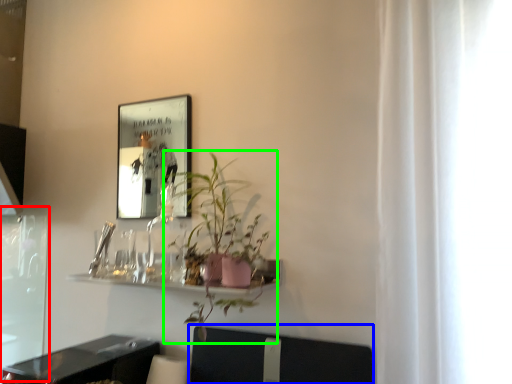
Question: Considering the real-world distances, which object is closest to screen door (highlighted by a red box)? swivel chair (highlighted by a blue box) or houseplant (highlighted by a green box).

Choices:
 (A) swivel chair
 (B) houseplant

Answer: (B)